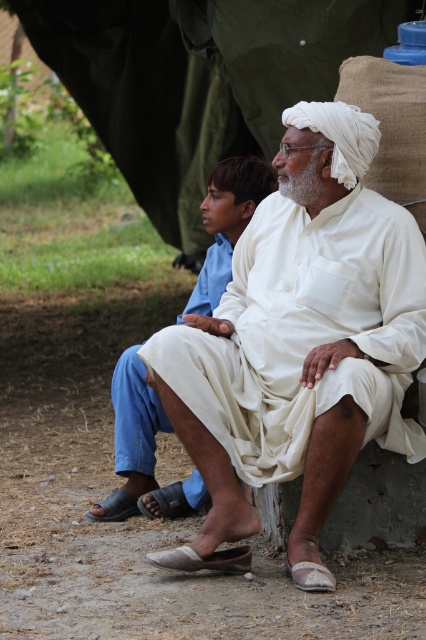
Who is positioned more to the right, white cotton kurta at center or white cotton dhoti at center?

white cotton kurta at center

Find the location of a particular element. white cotton kurta at center is located at coordinates (141, 451).

Is point (158, 396) closer to camera compared to point (140, 344)?

Yes, point (158, 396) is in front of point (140, 344).

Where is `white cotton kurta at center`? The width and height of the screenshot is (426, 640). white cotton kurta at center is located at coordinates (141, 451).

Which is more to the left, white cotton turban at upper center or white cotton dhoti at center?

From the viewer's perspective, white cotton dhoti at center appears more on the left side.

Based on the photo, is white cotton turban at upper center positioned at the back of white cotton dhoti at center?

No, white cotton turban at upper center is in front of white cotton dhoti at center.

Is point (367, 113) positioned in front of point (120, 376)?

Yes, point (367, 113) is in front of point (120, 376).

Image resolution: width=426 pixels, height=640 pixels. Identify the location of white cotton turban at upper center. (299, 344).

Between white cotton turban at upper center and white cotton kurta at center, which one appears on the right side from the viewer's perspective?

white cotton turban at upper center is more to the right.

Which is in front, point (207, 566) or point (213, 260)?

Positioned in front is point (207, 566).

Image resolution: width=426 pixels, height=640 pixels. Identify the location of white cotton turban at upper center. (299, 344).